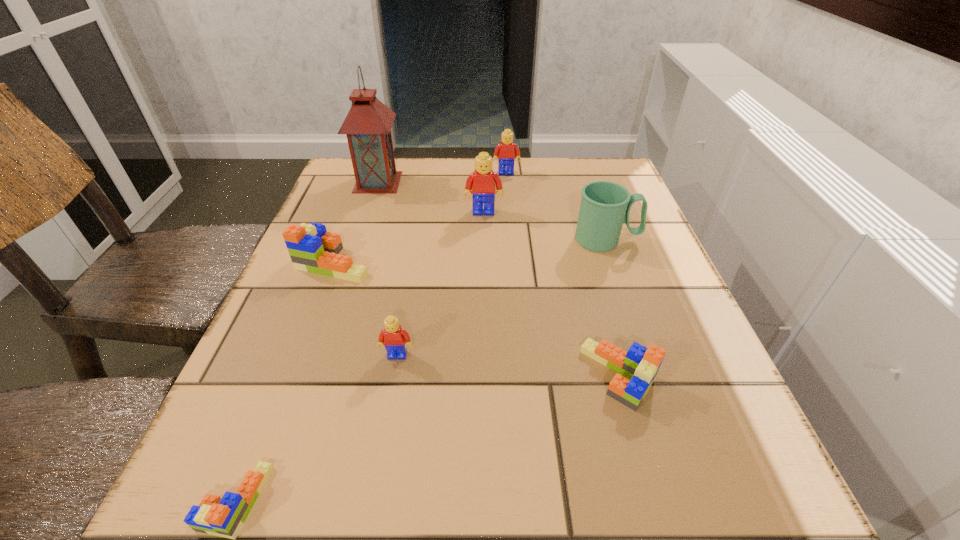
Image resolution: width=960 pixels, height=540 pixels. In order to click on free space located on the front of the second nearest orange Lego in this screenshot , I will do [646, 471].

Locate an element on the screen. vacant space located on the back of the shortest object is located at coordinates (305, 322).

Where is `lantern present at the far edge`? lantern present at the far edge is located at coordinates (368, 124).

You are a GUI agent. You are given a task and a screenshot of the screen. Output one action in this format:
    pyautogui.click(x=<x>, y=<y>)
    Task: Click on the Lego at the far edge
    
    Given the screenshot: What is the action you would take?
    pyautogui.click(x=505, y=151)

This screenshot has height=540, width=960. What are the coordinates of `object present at the near edge` in the screenshot? It's located at (224, 517).

Locate an element on the screen. This screenshot has height=540, width=960. lantern that is positioned at the left edge is located at coordinates (368, 124).

Image resolution: width=960 pixels, height=540 pixels. Find the location of `mug positioned at the right edge`. mug positioned at the right edge is located at coordinates (605, 206).

At what (x,y) coordinates should I click in order to perform the action: click on Lego at the right edge. Please return your answer as a coordinate pair (x, y). Looking at the image, I should click on (640, 364).

Identify the location of object present at the far left corner. This screenshot has height=540, width=960. pyautogui.click(x=368, y=124).

This screenshot has height=540, width=960. What are the coordinates of `object that is at the near left corner` in the screenshot? It's located at (224, 517).